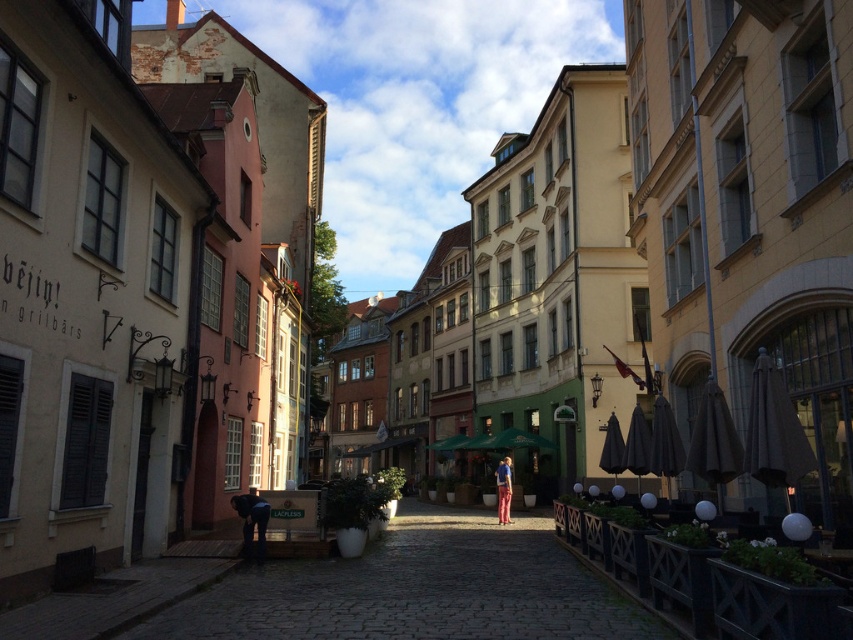
Is point (245, 509) behind point (496, 481)?

No, (245, 509) is in front of (496, 481).

Who is shorter, matte black jacket at lower left or blue denim shirt at center?

matte black jacket at lower left is shorter.

Is point (247, 556) closer to camera compared to point (503, 486)?

That is True.

At what (x,y) coordinates should I click in order to perform the action: click on matte black jacket at lower left. Please return your answer as a coordinate pair (x, y). Looking at the image, I should click on click(252, 522).

Can you confirm if smooth wooden bench at center is positioned to the left of blue denim shirt at center?

Indeed, smooth wooden bench at center is positioned on the left side of blue denim shirt at center.

Between point (332, 628) and point (503, 497), which one is positioned in front?

Point (332, 628) is in front.

Describe the element at coordinates (418, 589) in the screenshot. The width and height of the screenshot is (853, 640). I see `smooth wooden bench at center` at that location.

Identify the location of smooth wooden bench at center. The height and width of the screenshot is (640, 853). (418, 589).

How distant is smooth wooden bench at center from matte black jacket at lower left?

They are 3.62 meters apart.

Is point (450, 552) farther from viewer compared to point (257, 513)?

Yes, point (450, 552) is behind point (257, 513).

The width and height of the screenshot is (853, 640). What do you see at coordinates (418, 589) in the screenshot?
I see `smooth wooden bench at center` at bounding box center [418, 589].

Image resolution: width=853 pixels, height=640 pixels. What are the coordinates of `smooth wooden bench at center` in the screenshot? It's located at (418, 589).